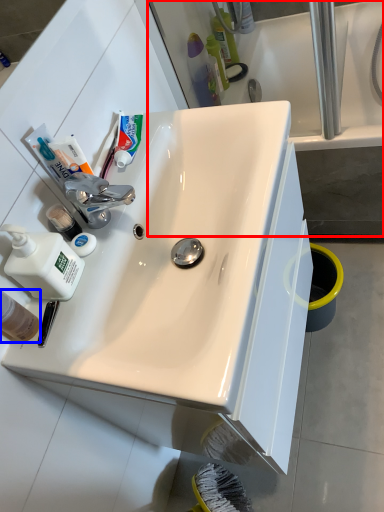
Question: Which point is closer to the camera, bath (highlighted by a red box) or mouthwash (highlighted by a blue box)?

Choices:
 (A) bath
 (B) mouthwash

Answer: (B)